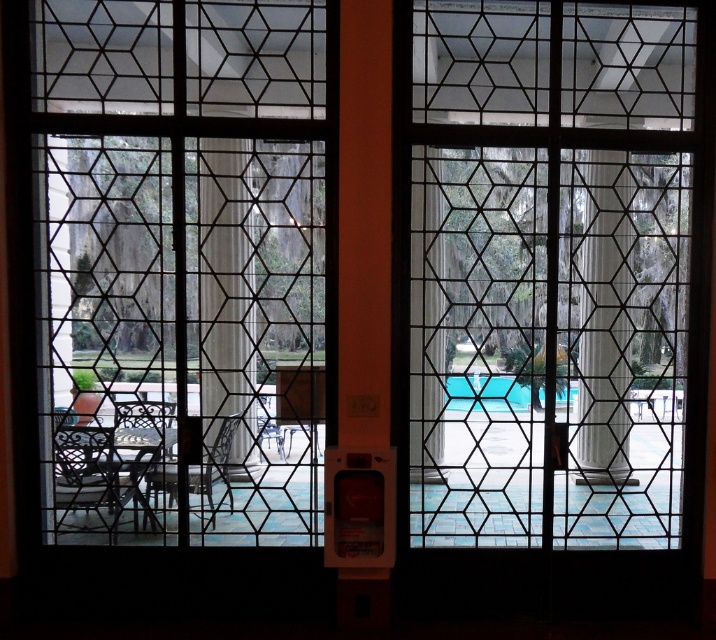
Between clear glass window at center and blue glossy pool at center, which one has more height?

Standing taller between the two is clear glass window at center.

Is point (67, 22) positioned after point (513, 385)?

No, (67, 22) is in front of (513, 385).

The image size is (716, 640). What are the coordinates of `clear glass window at center` in the screenshot? It's located at (180, 264).